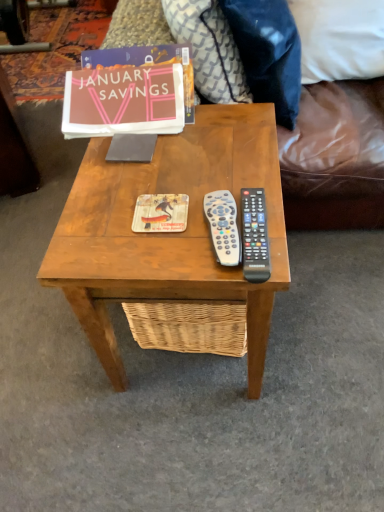
Image resolution: width=384 pixels, height=512 pixels. What are the coordinates of `vacant space that is in between white plastic remote at center, positioned as the first remote control in left-to-right order, and matte paper book cover at center` in the screenshot? It's located at (182, 243).